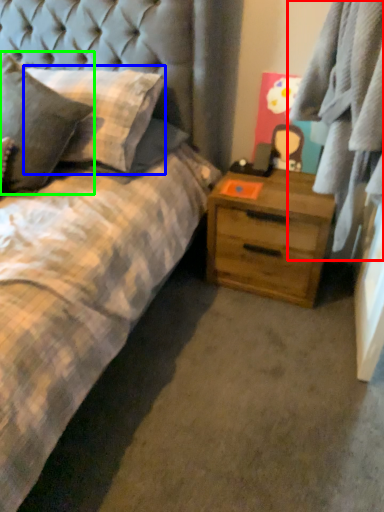
Question: Considering the real-world distances, which object is farthest from plaid (highlighted by a red box)? pillow (highlighted by a blue box) or pillow (highlighted by a green box)?

Choices:
 (A) pillow
 (B) pillow

Answer: (B)